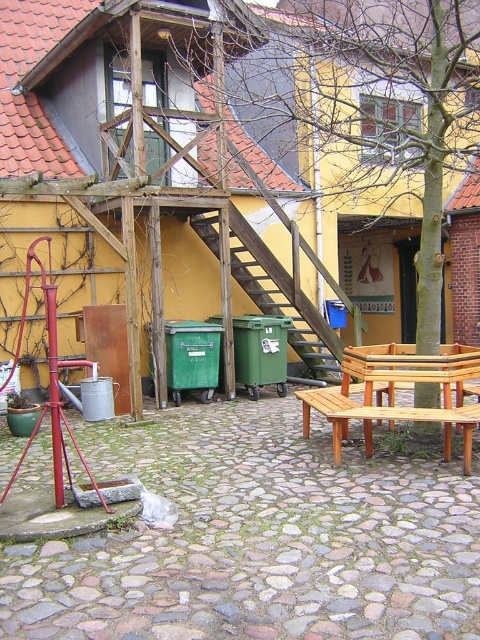
Which is behind, point (428, 371) or point (455, 417)?

Positioned behind is point (428, 371).

Measure the distance between light brown wooden picnic table at center and camera.

light brown wooden picnic table at center and camera are 5.88 meters apart from each other.

You are a GUI agent. You are given a task and a screenshot of the screen. Output one action in this format:
    pyautogui.click(x=<x>, y=<y>)
    Task: Click on the light brown wooden picnic table at center
    Image resolution: width=480 pixels, height=640 pixels.
    Given the screenshot: What is the action you would take?
    pyautogui.click(x=420, y=369)